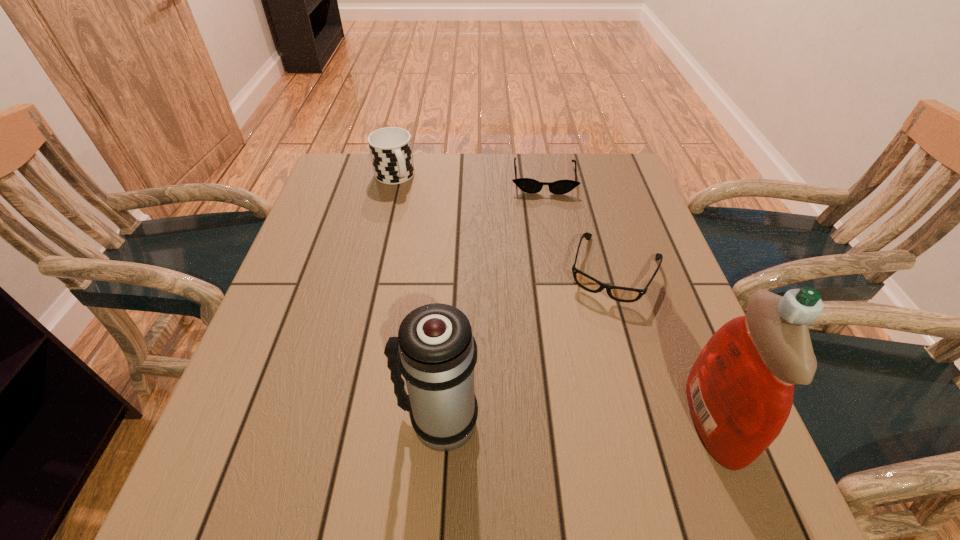
Identify the location of vacant space located on the front-facing side of the shortest object. The width and height of the screenshot is (960, 540). (544, 218).

Where is `vacant region located 0.210m on the front-facing side of the shortest object`? vacant region located 0.210m on the front-facing side of the shortest object is located at coordinates (546, 246).

Image resolution: width=960 pixels, height=540 pixels. In order to click on vacant space situated 0.100m on the front-facing side of the shortest object in this screenshot , I will do `click(544, 218)`.

Where is `vacant space positioned 0.240m on the side of the third shortest object with the handle`? vacant space positioned 0.240m on the side of the third shortest object with the handle is located at coordinates (433, 241).

Locate an element on the screen. The height and width of the screenshot is (540, 960). vacant region located on the side of the third shortest object with the handle is located at coordinates coord(413,210).

This screenshot has width=960, height=540. I want to click on free space located 0.350m on the side of the third shortest object with the handle, so click(450, 269).

The image size is (960, 540). In order to click on vacant position located 0.130m on the front-facing side of the third nearest object in this screenshot , I will do pyautogui.click(x=584, y=349).

This screenshot has height=540, width=960. Find the location of `vacant region located 0.190m on the front-facing side of the third nearest object`. vacant region located 0.190m on the front-facing side of the third nearest object is located at coordinates (575, 374).

This screenshot has width=960, height=540. What are the coordinates of `vacant space located on the front-facing side of the third nearest object` in the screenshot? It's located at (570, 386).

Identify the location of sunglasses that is at the far edge. This screenshot has height=540, width=960. (528, 185).